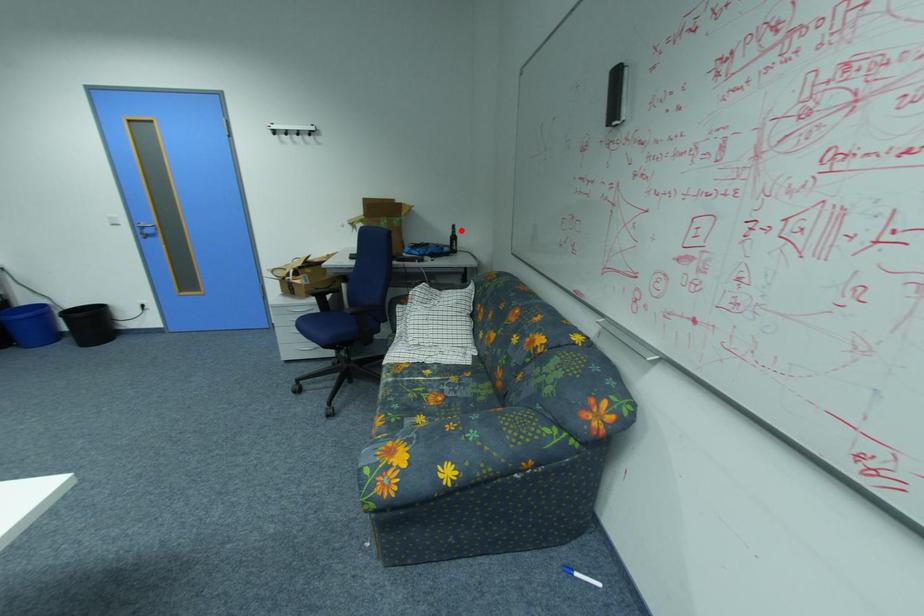
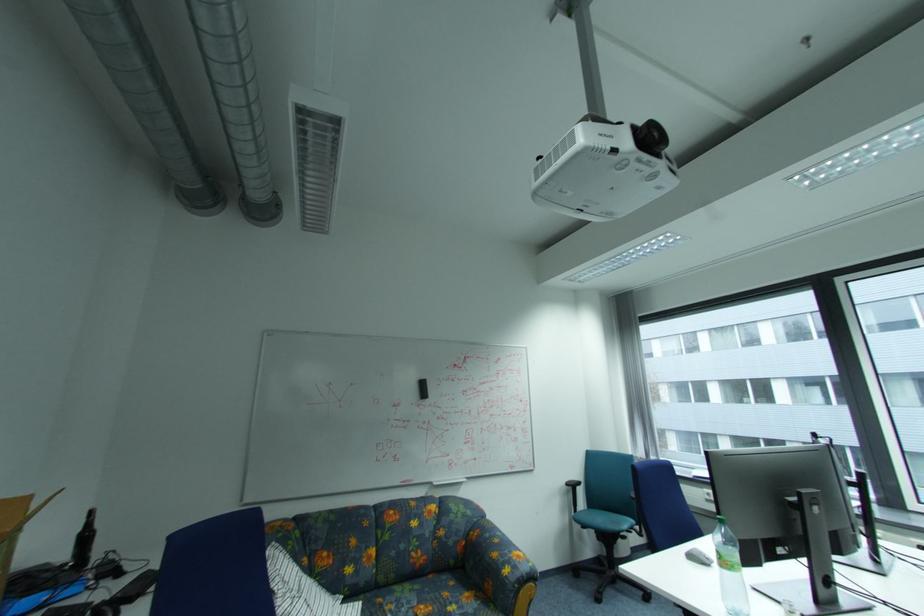
Question: I am providing you with two images of the same scene from different viewpoints. A red point is shown in image1. For the corresponding object point in image2, is it positioned nearer or farther from the camera?

Choices:
 (A) Nearer
 (B) Farther

Answer: (B)